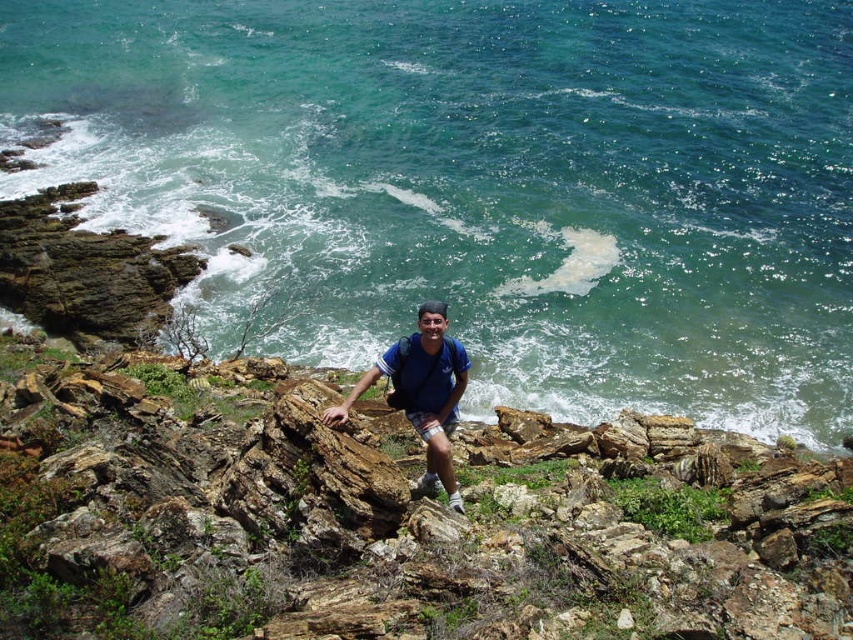
Question: Which of the following is the farthest from the observer?

Choices:
 (A) (541, 205)
 (B) (427, 403)

Answer: (A)

Question: Can you confirm if green water at upper center is positioned to the right of blue fabric shirt at center?

Choices:
 (A) yes
 (B) no

Answer: (A)

Question: Which point is closer to the camera taking this photo?

Choices:
 (A) (257, 257)
 (B) (453, 380)

Answer: (B)

Question: In this image, where is green water at upper center located relative to blue fabric shirt at center?

Choices:
 (A) left
 (B) right

Answer: (B)

Question: Does green water at upper center appear on the right side of blue fabric shirt at center?

Choices:
 (A) yes
 (B) no

Answer: (A)

Question: Which of the following is the farthest from the observer?

Choices:
 (A) (334, 410)
 (B) (647, 12)

Answer: (B)